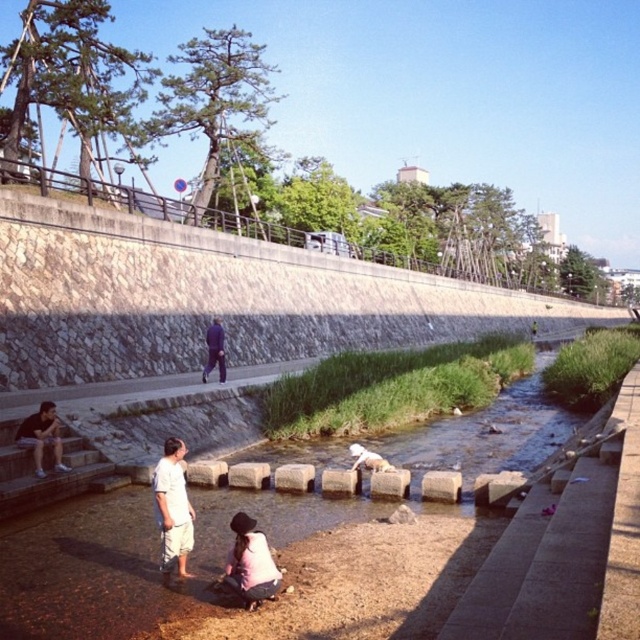
Question: Is white cotton shirt at lower center below light pink fabric at lower center?

Choices:
 (A) yes
 (B) no

Answer: (B)

Question: Which of the following is the closest to the observer?

Choices:
 (A) (220, 241)
 (B) (211, 326)

Answer: (B)

Question: Which point is farther to the camera?

Choices:
 (A) matte black shirt at left
 (B) light pink fabric at lower center
 (C) white cotton shirt at lower center
 (D) white cotton shirt at center

Answer: (D)

Question: Which point is farther from the camera taking this photo?

Choices:
 (A) (372, 458)
 (B) (186, 529)
 (C) (209, 340)
 (D) (16, 435)

Answer: (C)

Question: Can you confirm if light pink fabric at lower center is smaller than dark blue fabric jacket at center?

Choices:
 (A) no
 (B) yes

Answer: (A)

Question: Can you confirm if dark blue fabric jacket at center is wider than white cotton shirt at center?

Choices:
 (A) no
 (B) yes

Answer: (A)